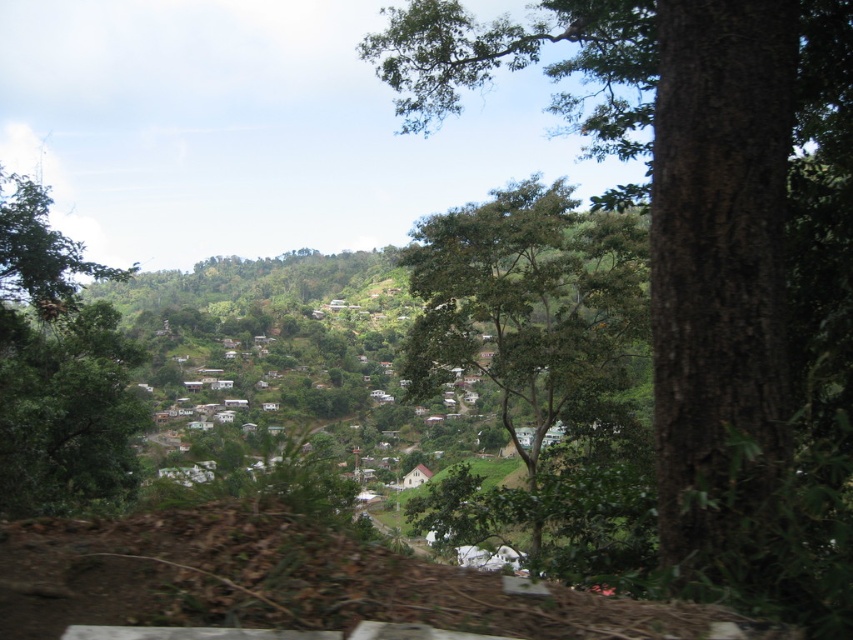
Question: Among these objects, which one is nearest to the camera?

Choices:
 (A) green rough bark tree at center
 (B) green leafy tree at left

Answer: (A)

Question: Which point is farther to the camera?

Choices:
 (A) green rough bark tree at center
 (B) green leafy tree at left

Answer: (B)

Question: Which object is positioned farthest from the green leafy tree at left?

Choices:
 (A) green leafy tree at center
 (B) green rough bark tree at center

Answer: (B)

Question: Can you confirm if green leafy tree at center is bigger than green leafy tree at left?

Choices:
 (A) no
 (B) yes

Answer: (B)

Question: Does green rough bark tree at center appear under green leafy tree at left?

Choices:
 (A) yes
 (B) no

Answer: (B)

Question: Can you confirm if green rough bark tree at center is smaller than green leafy tree at left?

Choices:
 (A) yes
 (B) no

Answer: (B)